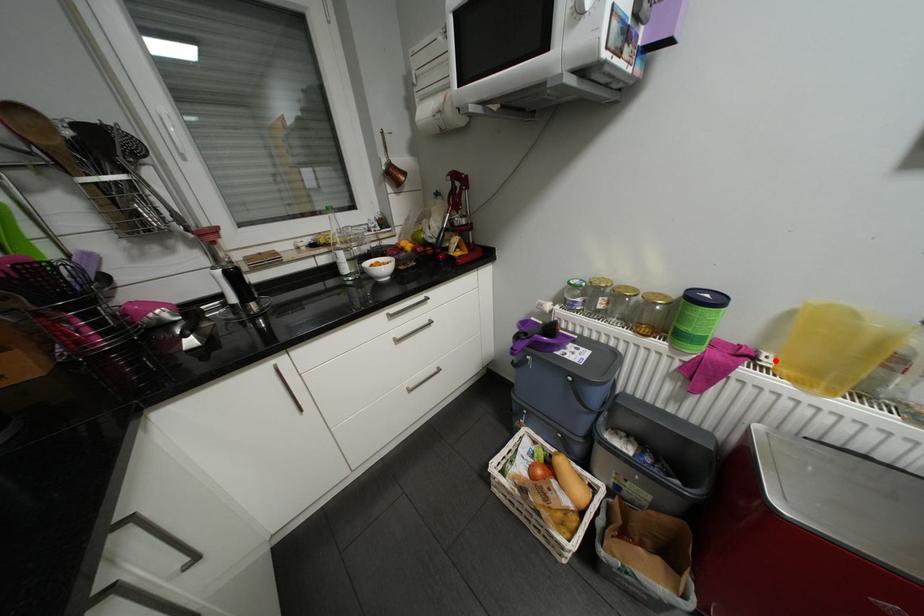
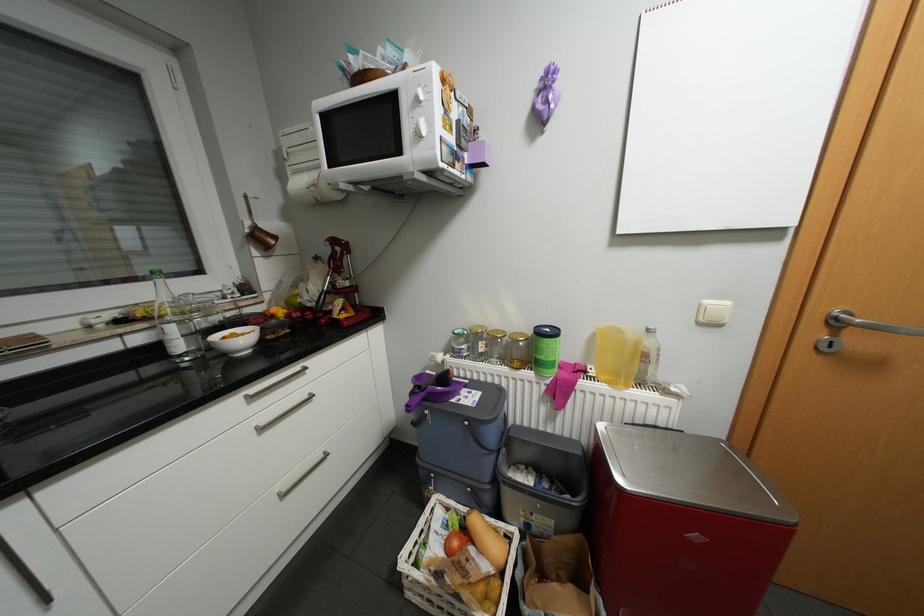
In the second image, find the point that corresponds to the highlighted location in the first image.

(600, 371)